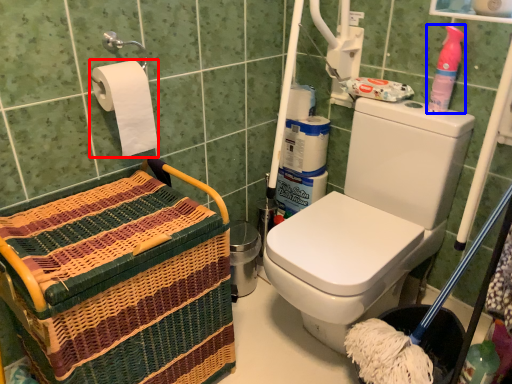
Question: Which object is closer to the camera taking this photo, toilet paper (highlighted by a red box) or cleaning product (highlighted by a blue box)?

Choices:
 (A) toilet paper
 (B) cleaning product

Answer: (A)